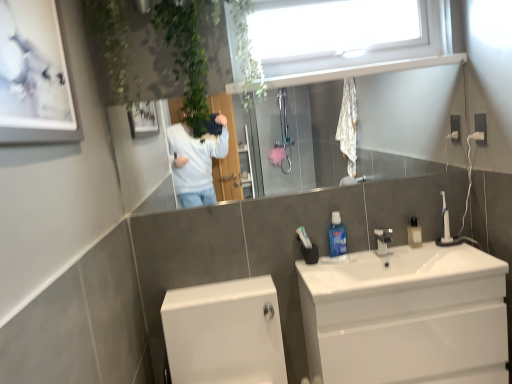
In the scene shown: Measure the distance between blue plastic mouthwash at center, positioned as the first mouthwash in left-to-right order, and camera.

blue plastic mouthwash at center, positioned as the first mouthwash in left-to-right order, is 2.04 meters away from camera.

Image resolution: width=512 pixels, height=384 pixels. What do you see at coordinates (366, 70) in the screenshot? I see `glossy glass mirror at upper center` at bounding box center [366, 70].

Image resolution: width=512 pixels, height=384 pixels. What do you see at coordinates (224, 333) in the screenshot?
I see `white glossy toilet at lower left` at bounding box center [224, 333].

Where is `blue plastic mouthwash at center, positioned as the first mouthwash in left-to-right order`? The image size is (512, 384). blue plastic mouthwash at center, positioned as the first mouthwash in left-to-right order is located at coordinates (337, 236).

Considering the relative sizes of white plastic window at upper center and glossy glass mirror at upper center in the image provided, is white plastic window at upper center thinner than glossy glass mirror at upper center?

Incorrect, the width of white plastic window at upper center is not less than that of glossy glass mirror at upper center.

Which is closer to the camera, (258, 26) or (141, 195)?

The point (258, 26) is closer.

From a real-world perspective, who is located lower, white plastic window at upper center or glossy glass mirror at upper center?

From a 3D spatial view, glossy glass mirror at upper center is below.

Which is more to the right, white plastic window at upper center or glossy glass mirror at upper center?

Positioned to the right is white plastic window at upper center.

Locate an element on the screen. The width and height of the screenshot is (512, 384). the 1st mouthwash positioned below the glossy glass mirror at upper center (from a real-world perspective) is located at coordinates tap(337, 236).

Measure the distance between blue plastic mouthwash at center, positioned as the first mouthwash in left-to-right order, and glossy glass mirror at upper center.

The distance of blue plastic mouthwash at center, positioned as the first mouthwash in left-to-right order, from glossy glass mirror at upper center is 1.05 meters.

Consider the image. Is blue plastic mouthwash at center, positioned as the 2th mouthwash in right-to-left order, taller or shorter than glossy glass mirror at upper center?

blue plastic mouthwash at center, positioned as the 2th mouthwash in right-to-left order, is shorter than glossy glass mirror at upper center.

Could you tell me if white glossy picture frame at upper left is turned towards white glossy cabinet at lower right?

No, white glossy picture frame at upper left is not turned towards white glossy cabinet at lower right.

Considering the sizes of objects white glossy picture frame at upper left and white glossy cabinet at lower right in the image provided, who is taller, white glossy picture frame at upper left or white glossy cabinet at lower right?

white glossy cabinet at lower right.

Does point (14, 114) appear closer or farther from the camera than point (336, 341)?

Clearly, point (14, 114) is closer to the camera than point (336, 341).

Could you tell me if white glossy picture frame at upper left is facing white glossy toilet at lower left?

No, white glossy picture frame at upper left is not facing towards white glossy toilet at lower left.

Which object is thinner, white glossy picture frame at upper left or white glossy toilet at lower left?

With smaller width is white glossy picture frame at upper left.

In the scene shown: From a real-world perspective, does white glossy picture frame at upper left stand above white glossy toilet at lower left?

Yes, from a real-world perspective, white glossy picture frame at upper left is on top of white glossy toilet at lower left.

Considering their positions, is white glossy picture frame at upper left located in front of or behind white glossy toilet at lower left?

Clearly, white glossy picture frame at upper left is in front of white glossy toilet at lower left.

How much distance is there between translucent plastic mouthwash at sink right, arranged as the 2th mouthwash when viewed from the left, and glossy glass mirror at upper center?

translucent plastic mouthwash at sink right, arranged as the 2th mouthwash when viewed from the left, is 4.68 feet away from glossy glass mirror at upper center.

Is translucent plastic mouthwash at sink right, arranged as the 2th mouthwash when viewed from the left, to the left of glossy glass mirror at upper center from the viewer's perspective?

Incorrect, translucent plastic mouthwash at sink right, arranged as the 2th mouthwash when viewed from the left, is not on the left side of glossy glass mirror at upper center.

Is translucent plastic mouthwash at sink right, arranged as the 2th mouthwash when viewed from the left, in contact with glossy glass mirror at upper center?

translucent plastic mouthwash at sink right, arranged as the 2th mouthwash when viewed from the left, and glossy glass mirror at upper center are not in contact.

Between translucent plastic mouthwash at sink right, the 1th mouthwash positioned from the right, and glossy glass mirror at upper center, which one has more height?

Standing taller between the two is glossy glass mirror at upper center.

Which of these two, glossy glass mirror at upper center or white glossy cabinet at lower right, is bigger?

white glossy cabinet at lower right.

Are glossy glass mirror at upper center and white glossy cabinet at lower right located far from each other?

Yes, glossy glass mirror at upper center is far from white glossy cabinet at lower right.

Is glossy glass mirror at upper center wider or thinner than white glossy cabinet at lower right?

glossy glass mirror at upper center is thinner than white glossy cabinet at lower right.

Looking at their sizes, would you say white glossy toilet at lower left is wider or thinner than blue plastic mouthwash at center, positioned as the first mouthwash in left-to-right order?

Answer: In the image, white glossy toilet at lower left appears to be wider than blue plastic mouthwash at center, positioned as the first mouthwash in left-to-right order.

From the image's perspective, who appears lower, white glossy toilet at lower left or blue plastic mouthwash at center, positioned as the first mouthwash in left-to-right order?

white glossy toilet at lower left, from the image's perspective.

Which is closer to the camera, (242, 327) or (337, 237)?

Clearly, point (242, 327) is closer to the camera than point (337, 237).

Does white glossy toilet at lower left appear on the right side of blue plastic mouthwash at center, positioned as the first mouthwash in left-to-right order?

In fact, white glossy toilet at lower left is to the left of blue plastic mouthwash at center, positioned as the first mouthwash in left-to-right order.

You are a GUI agent. You are given a task and a screenshot of the screen. Output one action in this format:
    pyautogui.click(x=<x>, y=<y>)
    Task: Click on the mirror located underneath the white plastic window at upper center (from a real-world perspective)
    
    Given the screenshot: What is the action you would take?
    pyautogui.click(x=366, y=70)

What are the coordinates of `mouthwash that is the 2nd object located below the glossy glass mirror at upper center (from the image's perspective)` in the screenshot? It's located at (337, 236).

Considering their positions, is blue plastic mouthwash at center, positioned as the 2th mouthwash in right-to-left order, positioned further to white glossy sink at center than white glossy picture frame at upper left?

white glossy picture frame at upper left.

When comparing their distances from glossy glass mirror at upper center, does translucent plastic mouthwash at sink right, the 1th mouthwash positioned from the right, or white glossy toilet at lower left seem further?

translucent plastic mouthwash at sink right, the 1th mouthwash positioned from the right.

Looking at the image, which one is located closer to blue plastic mouthwash at center, positioned as the first mouthwash in left-to-right order, white glossy picture frame at upper left or white glossy toilet at lower left?

white glossy toilet at lower left is closer to blue plastic mouthwash at center, positioned as the first mouthwash in left-to-right order.

Estimate the real-world distances between objects in this image. Which object is further from white glossy picture frame at upper left, white glossy sink at center or glossy glass mirror at upper center?

Based on the image, white glossy sink at center appears to be further to white glossy picture frame at upper left.

Considering their positions, is white glossy picture frame at upper left positioned closer to glossy glass mirror at upper center than white glossy toilet at lower left?

Based on the image, white glossy toilet at lower left appears to be nearer to glossy glass mirror at upper center.

Considering their positions, is white glossy sink at center positioned further to white glossy toilet at lower left than translucent plastic mouthwash at sink right, arranged as the 2th mouthwash when viewed from the left?

Based on the image, translucent plastic mouthwash at sink right, arranged as the 2th mouthwash when viewed from the left, appears to be further to white glossy toilet at lower left.

When comparing their distances from white glossy sink at center, does white glossy picture frame at upper left or white glossy toilet at lower left seem further?

white glossy picture frame at upper left lies further to white glossy sink at center than the other object.

Which object lies further to the anchor point white glossy picture frame at upper left, white plastic window at upper center or translucent plastic mouthwash at sink right, the 1th mouthwash positioned from the right?

Based on the image, translucent plastic mouthwash at sink right, the 1th mouthwash positioned from the right, appears to be further to white glossy picture frame at upper left.

At what (x,y) coordinates should I click in order to perform the action: click on mouthwash situated between white glossy toilet at lower left and white glossy sink at center from left to right. Please return your answer as a coordinate pair (x, y). This screenshot has height=384, width=512. Looking at the image, I should click on (337, 236).

You are a GUI agent. You are given a task and a screenshot of the screen. Output one action in this format:
    pyautogui.click(x=<x>, y=<y>)
    Task: Click on the bathroom cabinet located between white glossy picture frame at upper left and translucent plastic mouthwash at sink right, arranged as the 2th mouthwash when viewed from the left, in the left-right direction
    Image resolution: width=512 pixels, height=384 pixels.
    Given the screenshot: What is the action you would take?
    pyautogui.click(x=406, y=316)

This screenshot has height=384, width=512. I want to click on sink between glossy glass mirror at upper center and white glossy toilet at lower left vertically, so click(399, 271).

Locate an element on the screen. The height and width of the screenshot is (384, 512). mirror between white glossy picture frame at upper left and white glossy toilet at lower left vertically is located at coordinates (366, 70).